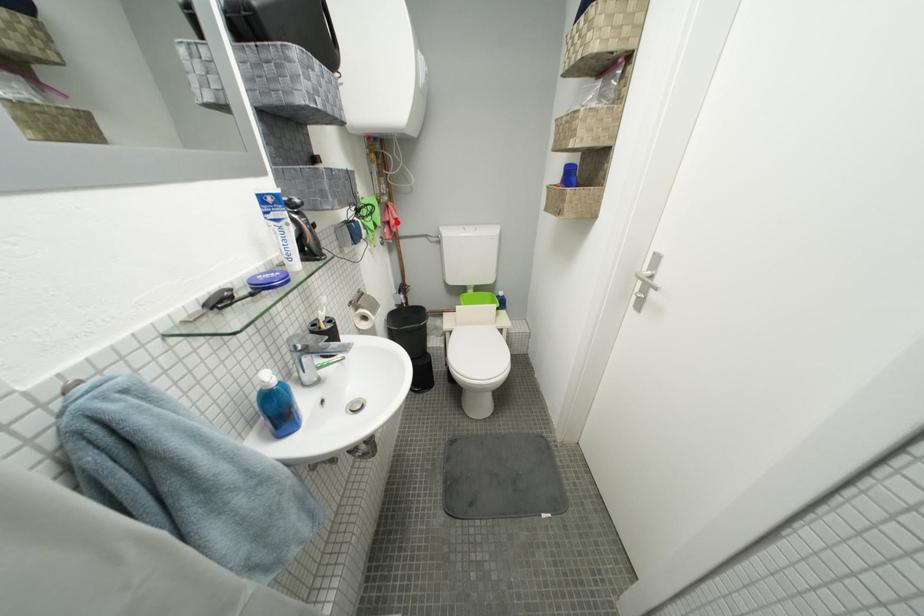
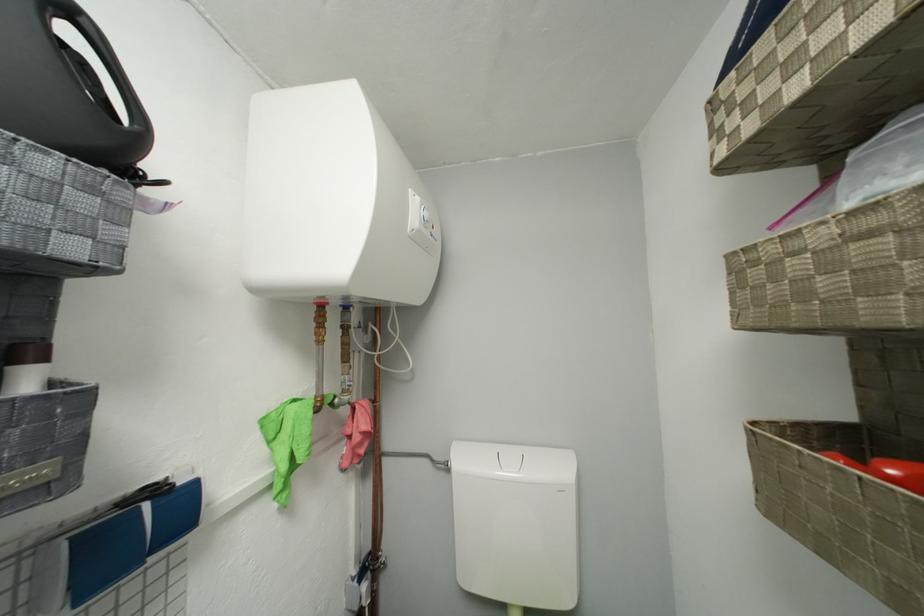
In the second image, find the point that corresponds to the highlighted location in the first image.

(358, 435)